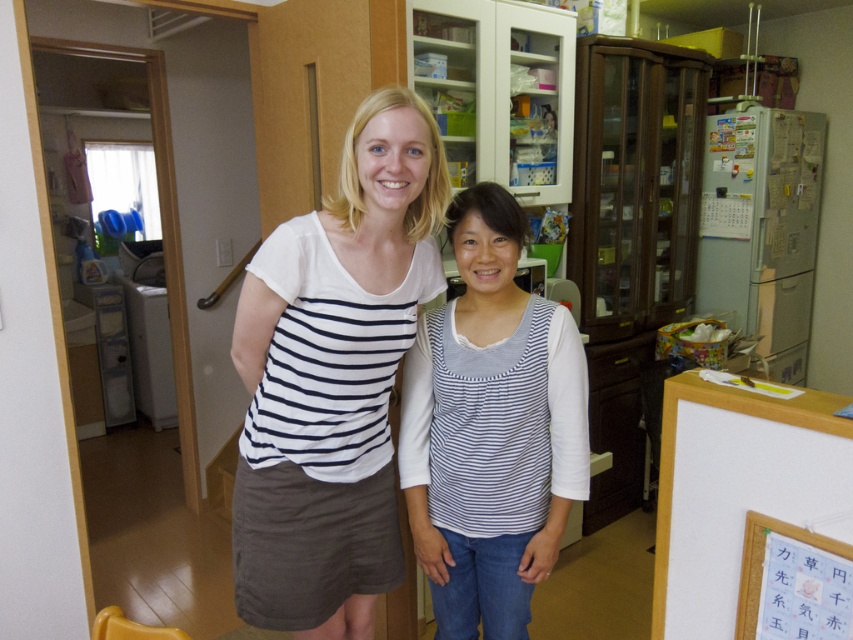
Question: Which point appears farthest from the camera in this image?

Choices:
 (A) (364, 449)
 (B) (440, 582)

Answer: (B)

Question: Which point is closer to the camera?

Choices:
 (A) white striped tank top at center
 (B) white cotton shirt at center

Answer: (B)

Question: Can you confirm if white cotton shirt at center is wider than white striped tank top at center?

Choices:
 (A) no
 (B) yes

Answer: (B)

Question: Is white cotton shirt at center in front of white striped tank top at center?

Choices:
 (A) yes
 (B) no

Answer: (A)

Question: Which of the following is the farthest from the observer?

Choices:
 (A) white cotton shirt at center
 (B) white striped tank top at center

Answer: (B)

Question: Is white cotton shirt at center above white striped tank top at center?

Choices:
 (A) no
 (B) yes

Answer: (B)